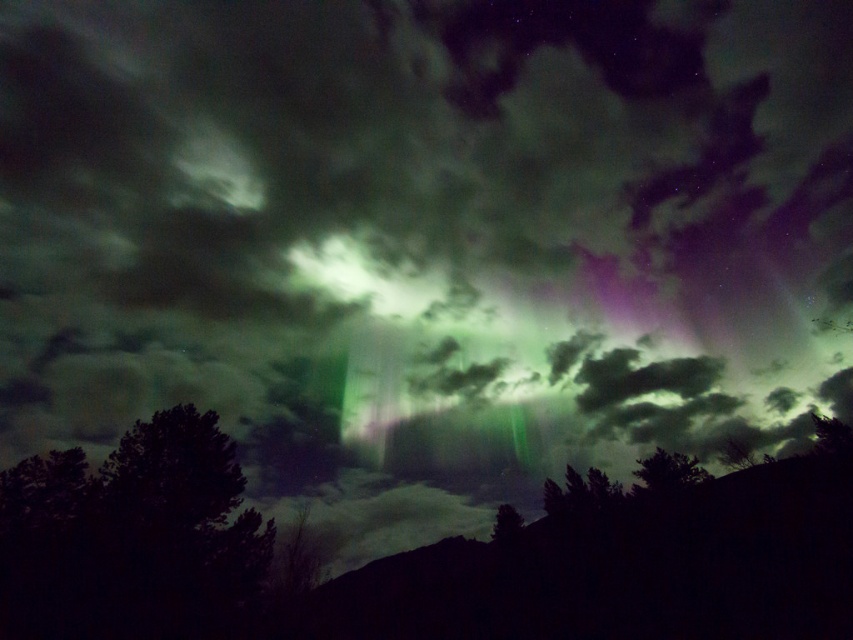
Question: Which point is farther from the camera taking this photo?

Choices:
 (A) [155, 588]
 (B) [505, 536]

Answer: (B)

Question: Can you confirm if dark green leafy tree at lower left is positioned above green leafy tree at lower center?

Choices:
 (A) yes
 (B) no

Answer: (A)

Question: Does dark green leafy tree at lower left appear on the right side of green leafy tree at lower center?

Choices:
 (A) no
 (B) yes

Answer: (A)

Question: Where is dark green leafy tree at lower left located in relation to green leafy tree at lower center in the image?

Choices:
 (A) below
 (B) above

Answer: (B)